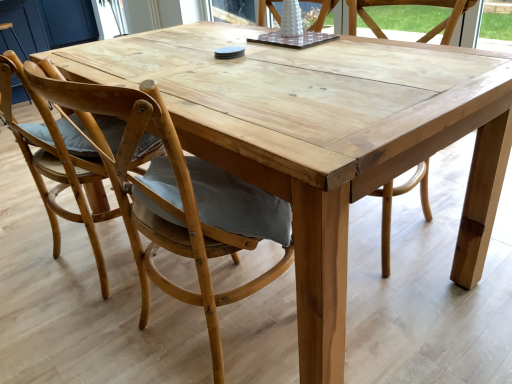
Question: Is white matte vase at upper center, the 3th chair when ordered from left to right, bigger than light brown wood chair at left, acting as the 1th chair starting from the left?

Choices:
 (A) yes
 (B) no

Answer: (B)

Question: Is white matte vase at upper center, which is the second chair in right-to-left order, completely or partially outside of light brown wood chair at left, which ranks as the fourth chair in right-to-left order?

Choices:
 (A) yes
 (B) no

Answer: (A)

Question: Is white matte vase at upper center, which is the second chair in right-to-left order, with light brown wood chair at left, which ranks as the fourth chair in right-to-left order?

Choices:
 (A) no
 (B) yes

Answer: (A)

Question: Does white matte vase at upper center, the 3th chair when ordered from left to right, have a lesser height compared to light brown wood chair at left, which ranks as the fourth chair in right-to-left order?

Choices:
 (A) yes
 (B) no

Answer: (A)

Question: Can you confirm if white matte vase at upper center, the 3th chair when ordered from left to right, is wider than light brown wood chair at left, acting as the 1th chair starting from the left?

Choices:
 (A) no
 (B) yes

Answer: (A)

Question: Considering the relative sizes of white matte vase at upper center, which is the second chair in right-to-left order, and light brown wood chair at left, acting as the 1th chair starting from the left, in the image provided, is white matte vase at upper center, which is the second chair in right-to-left order, smaller than light brown wood chair at left, acting as the 1th chair starting from the left,?

Choices:
 (A) no
 (B) yes

Answer: (B)

Question: Considering the relative sizes of white matte vase at upper center, which is the second chair in right-to-left order, and natural wood chair at center, the third chair in the right-to-left sequence, in the image provided, is white matte vase at upper center, which is the second chair in right-to-left order, smaller than natural wood chair at center, the third chair in the right-to-left sequence,?

Choices:
 (A) yes
 (B) no

Answer: (A)

Question: Does white matte vase at upper center, the 3th chair when ordered from left to right, lie in front of natural wood chair at center, the third chair in the right-to-left sequence?

Choices:
 (A) yes
 (B) no

Answer: (B)

Question: Does white matte vase at upper center, the 3th chair when ordered from left to right, contain natural wood chair at center, the third chair in the right-to-left sequence?

Choices:
 (A) no
 (B) yes

Answer: (A)

Question: Is white matte vase at upper center, the 3th chair when ordered from left to right, taller than natural wood chair at center, the third chair in the right-to-left sequence?

Choices:
 (A) yes
 (B) no

Answer: (B)

Question: Is white matte vase at upper center, the 3th chair when ordered from left to right, looking in the opposite direction of natural wood chair at center, the third chair in the right-to-left sequence?

Choices:
 (A) yes
 (B) no

Answer: (B)

Question: Does white matte vase at upper center, which is the second chair in right-to-left order, lie behind natural wood chair at center, placed as the second chair when sorted from left to right?

Choices:
 (A) yes
 (B) no

Answer: (A)

Question: Is white matte vase at upper center, the 3th chair when ordered from left to right, aimed at natural wood chair at center, which is counted as the 1th chair, starting from the right?

Choices:
 (A) no
 (B) yes

Answer: (A)